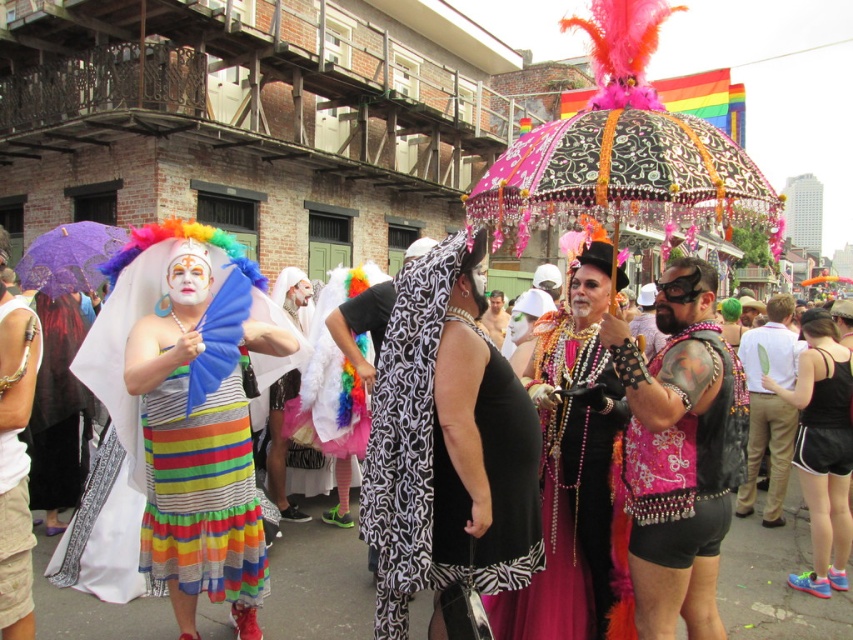
You are a photographer positioned at the matte black dress at left and want to capture a wide shot that includes both the shiny sequined dress at center and yourself. Given that your camera has a maximum focal length of 24mm, which is best for capturing wide shots, can you include both subjects in the frame without moving? Explain your reasoning based on their distance.

The distance between the shiny sequined dress at center and the matte black dress at left is 6.53 meters. With a 24mm focal length, which is considered wide enough to capture a broad scene, the photographer can likely include both subjects in the frame without needing to move, as 24mm typically allows for a field of view wide enough to encompass objects separated by that distance when positioned appropriately.